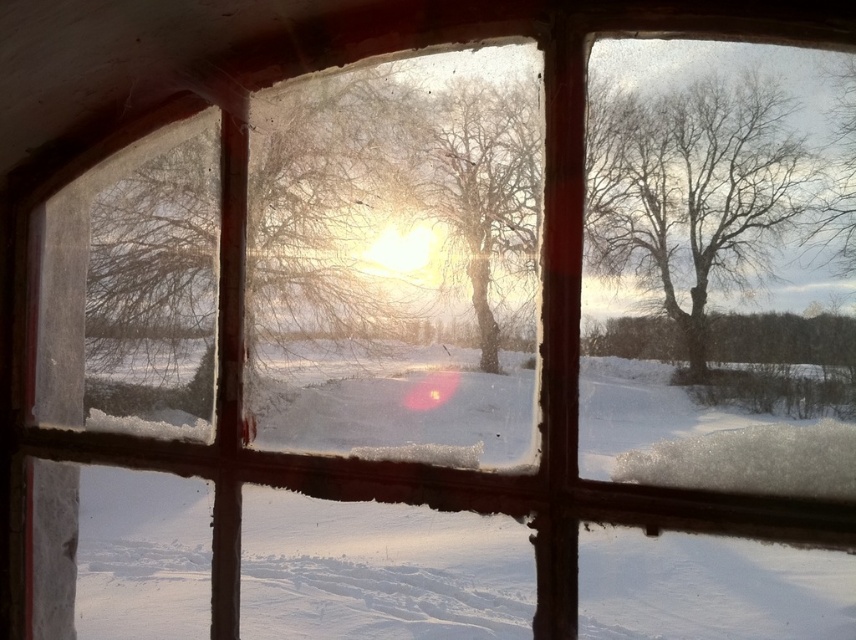
Is translucent frosted glass tree at center taller than bare wood tree at center?

Yes, translucent frosted glass tree at center is taller than bare wood tree at center.

Is point (367, 221) behind point (522, 154)?

Yes, it is.

What are the coordinates of `translucent frosted glass tree at center` in the screenshot? It's located at (321, 214).

Between translucent frosted glass tree at center and bare branches at center, which one has less height?

bare branches at center

Who is more forward, (138, 268) or (593, 218)?

Point (593, 218) is in front.

Does point (223, 237) lie behind point (688, 337)?

Yes.

Locate an element on the screen. Image resolution: width=856 pixels, height=640 pixels. translucent frosted glass tree at center is located at coordinates (321, 214).

Is bare branches at center thinner than bare wood tree at center?

No.

Can you confirm if bare branches at center is taller than bare wood tree at center?

No, bare branches at center is not taller than bare wood tree at center.

You are a GUI agent. You are given a task and a screenshot of the screen. Output one action in this format:
    pyautogui.click(x=<x>, y=<y>)
    Task: Click on the bare branches at center
    The height and width of the screenshot is (640, 856).
    Given the screenshot: What is the action you would take?
    pyautogui.click(x=693, y=192)